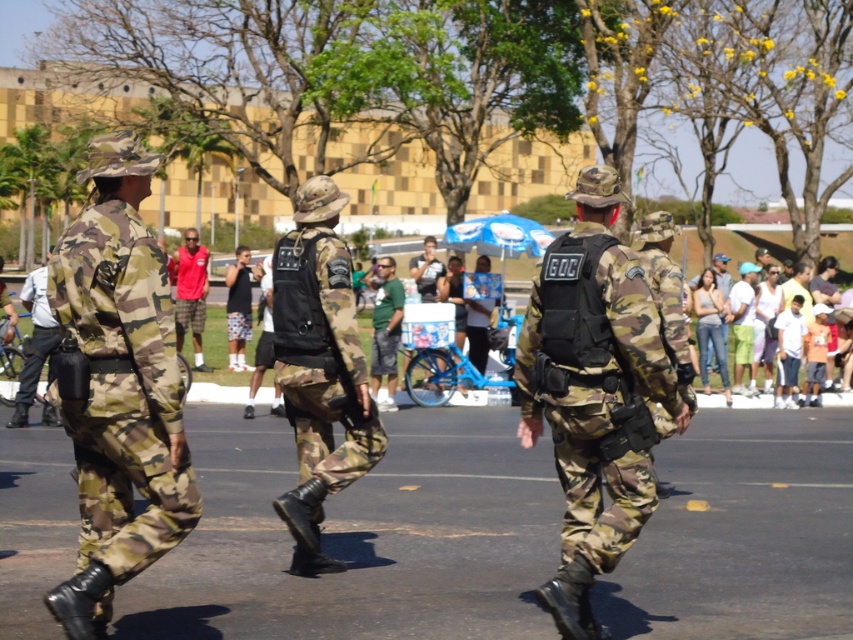
Question: Which point is closer to the camera taking this photo?

Choices:
 (A) (184, 307)
 (B) (22, 300)
 (C) (239, 310)
 (D) (380, 352)

Answer: (B)

Question: Which point is closer to the camera?

Choices:
 (A) (229, 333)
 (B) (427, 243)
 (C) (296, 552)
 (D) (157, 272)

Answer: (D)

Question: Is the position of red plaid shorts at center less distant than that of green camouflage pants at center?

Choices:
 (A) yes
 (B) no

Answer: (A)

Question: Does red plaid shorts at center have a greater width compared to matte black shirt at center?

Choices:
 (A) yes
 (B) no

Answer: (A)

Question: Where is light blue shirt at left located in relation to black matte tank top at center in the image?

Choices:
 (A) right
 (B) left

Answer: (B)

Question: Considering the real-world distances, which object is closest to the black matte tank top at center?

Choices:
 (A) camouflage fabric uniform at center
 (B) light blue shirt at left
 (C) camouflage fabric uniform at left

Answer: (B)